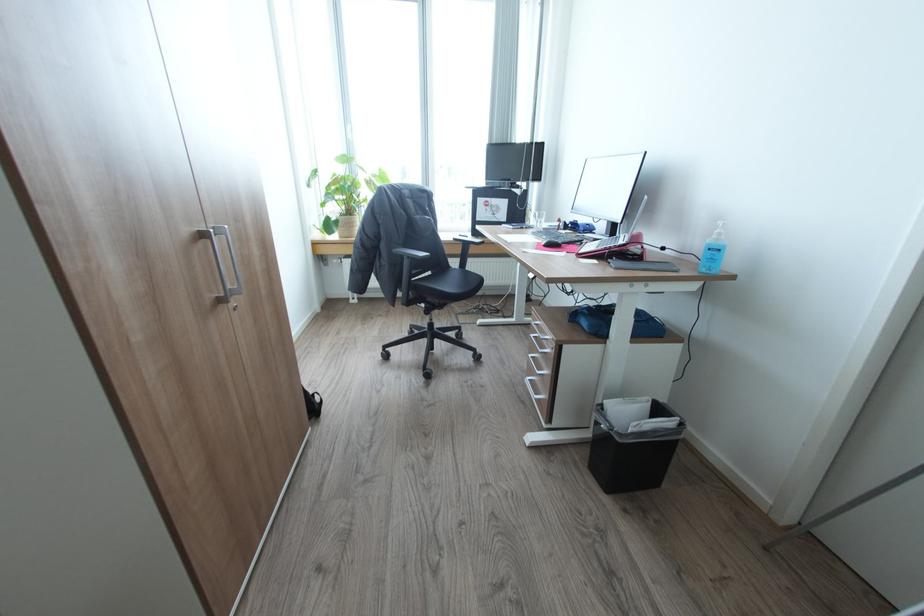
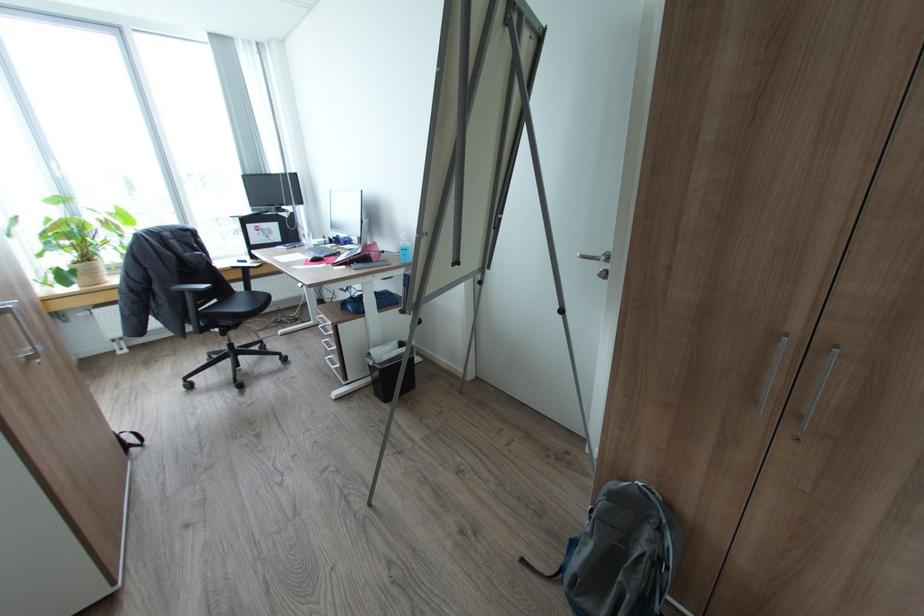
Find the pixel in the second image that matches point (715, 257) in the first image.

(408, 254)